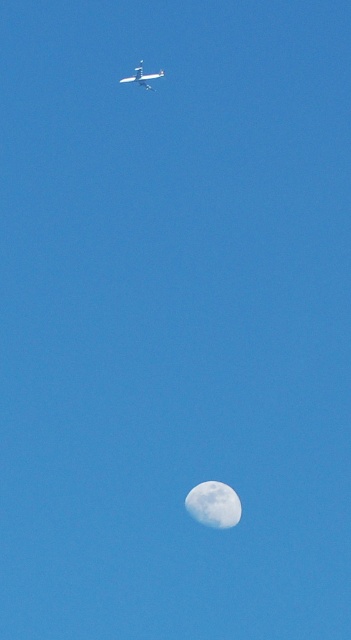
Is white textured moon at lower center behind metallic silver airplane at upper center?

Yes, white textured moon at lower center is further from the viewer.

Is point (196, 508) less distant than point (162, 68)?

No, (196, 508) is further to viewer.

The image size is (351, 640). Find the location of `white textured moon at lower center`. white textured moon at lower center is located at coordinates (214, 504).

Where is `white textured moon at lower center`? The height and width of the screenshot is (640, 351). white textured moon at lower center is located at coordinates (214, 504).